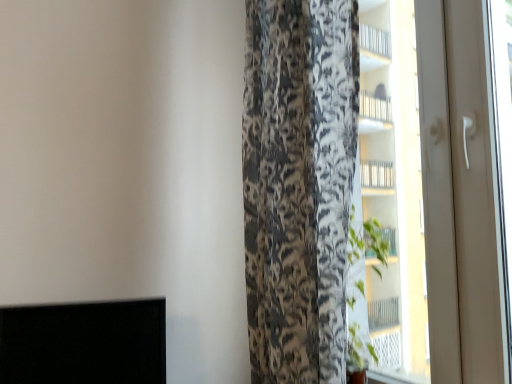
Image resolution: width=512 pixels, height=384 pixels. What do you see at coordinates (84, 343) in the screenshot?
I see `black matte computer monitor at lower left` at bounding box center [84, 343].

Image resolution: width=512 pixels, height=384 pixels. What are the coordinates of `black matte computer monitor at lower left` in the screenshot? It's located at (84, 343).

What is the approximate height of black matte computer monitor at lower left?

It is 11.66 inches.

Where is `black matte computer monitor at lower left`? The width and height of the screenshot is (512, 384). black matte computer monitor at lower left is located at coordinates (84, 343).